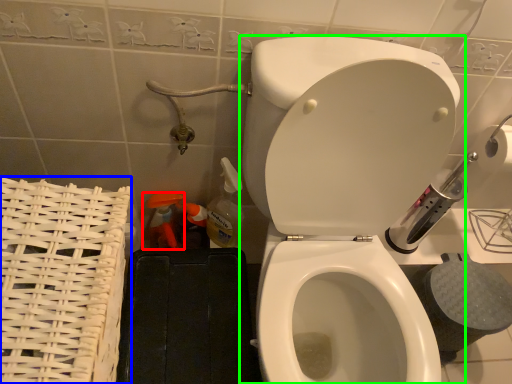
Question: Which is farther away from cleaning product (highlighted by a red box)? basket (highlighted by a blue box) or toilet (highlighted by a green box)?

Choices:
 (A) basket
 (B) toilet

Answer: (B)